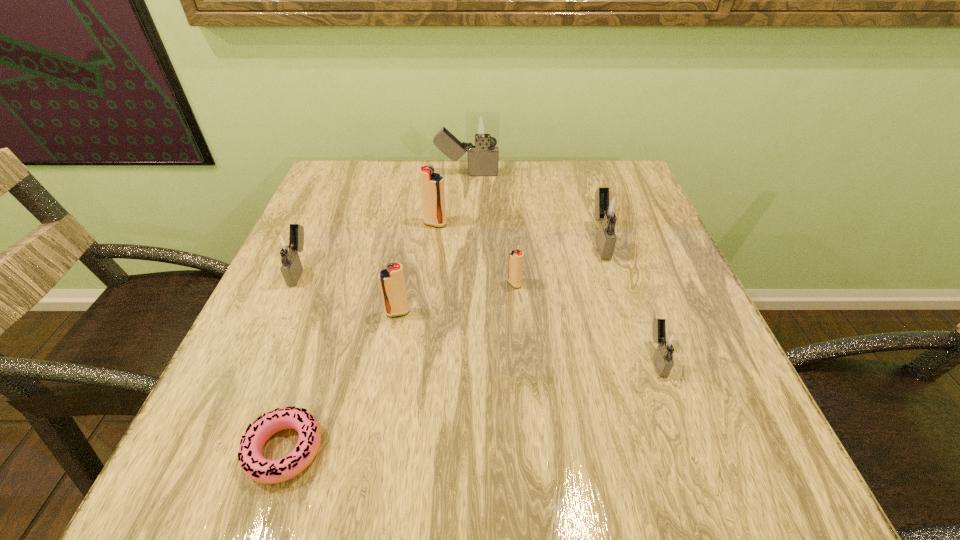
This screenshot has height=540, width=960. I want to click on the third gray igniter from right to left, so click(482, 128).

Find the location of `the tallest object`. the tallest object is located at coordinates (482, 128).

Locate an element on the screen. This screenshot has height=540, width=960. the second red igniter from right to left is located at coordinates (431, 184).

The width and height of the screenshot is (960, 540). Identify the location of the biggest red igniter. (431, 184).

Where is `the second biggest gray igniter`? This screenshot has height=540, width=960. the second biggest gray igniter is located at coordinates (611, 209).

The height and width of the screenshot is (540, 960). I want to click on the second smallest gray igniter, so click(288, 246).

Locate an element on the screen. the leftmost igniter is located at coordinates (288, 246).

Where is `the nearest red igniter`? This screenshot has width=960, height=540. the nearest red igniter is located at coordinates (392, 283).

At what (x,y) coordinates should I click in order to perform the action: click on the leftmost red igniter. Please return your answer as a coordinate pair (x, y). Image resolution: width=960 pixels, height=540 pixels. Looking at the image, I should click on (392, 283).

The width and height of the screenshot is (960, 540). What are the coordinates of `the fifth igniter from left to right` in the screenshot? It's located at (515, 268).